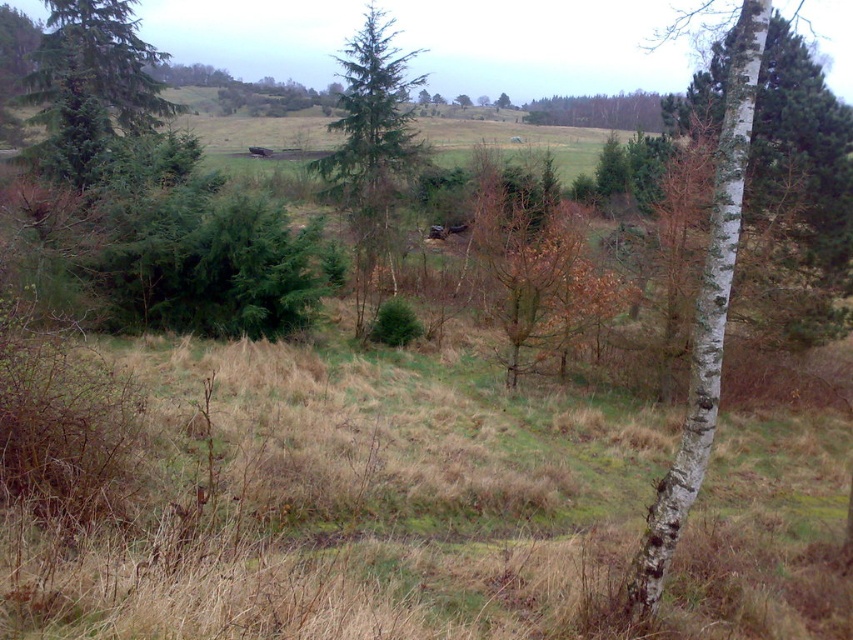
Can you confirm if green matte tree at left is positioned to the left of green leafy tree at upper center?

Indeed, green matte tree at left is positioned on the left side of green leafy tree at upper center.

From the picture: Between green matte tree at left and green leafy tree at upper center, which one has more height?

green leafy tree at upper center

What do you see at coordinates (93, 81) in the screenshot? The width and height of the screenshot is (853, 640). I see `green matte tree at left` at bounding box center [93, 81].

Locate an element on the screen. Image resolution: width=853 pixels, height=640 pixels. green matte tree at left is located at coordinates [x=93, y=81].

Which is more to the right, green matte tree at left or green matte tree at center?

green matte tree at center is more to the right.

In the scene shown: Does green matte tree at left appear under green matte tree at center?

Yes.

Does point (65, 74) come farther from viewer compared to point (358, 150)?

That is False.

I want to click on green matte tree at left, so click(x=93, y=81).

The width and height of the screenshot is (853, 640). Find the location of `green matte tree at center`. green matte tree at center is located at coordinates (370, 148).

Can you confirm if green matte tree at center is shorter than green leafy tree at upper center?

No, green matte tree at center is not shorter than green leafy tree at upper center.

Is point (364, 60) positioned before point (535, 108)?

Yes, point (364, 60) is closer to viewer.

Image resolution: width=853 pixels, height=640 pixels. Find the location of `green matte tree at center`. green matte tree at center is located at coordinates (370, 148).